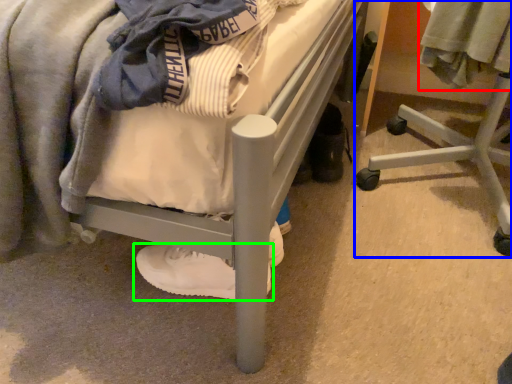
Question: Which object is the farthest from clothing (highlighted by a red box)? Choose among these: furniture (highlighted by a blue box) or footwear (highlighted by a green box).

Choices:
 (A) furniture
 (B) footwear

Answer: (B)